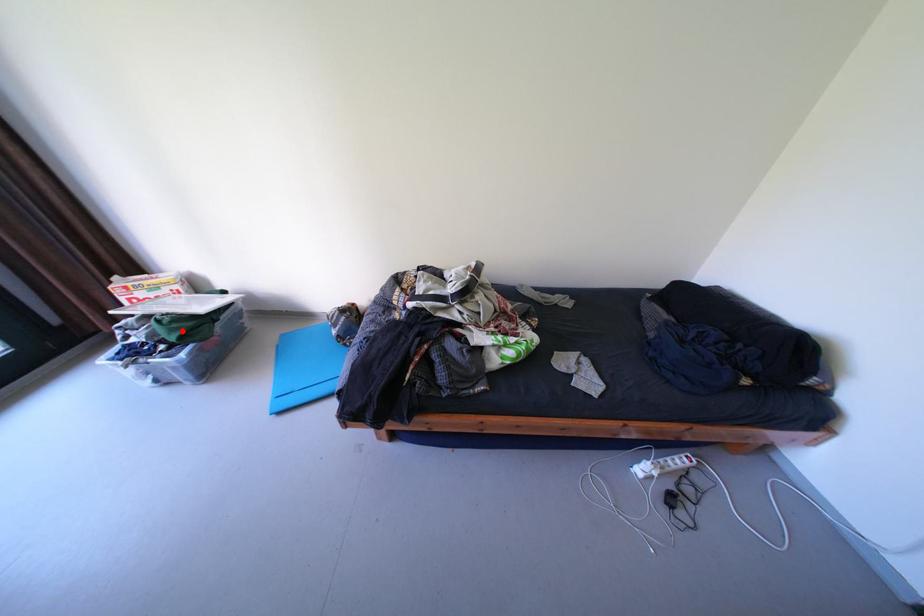
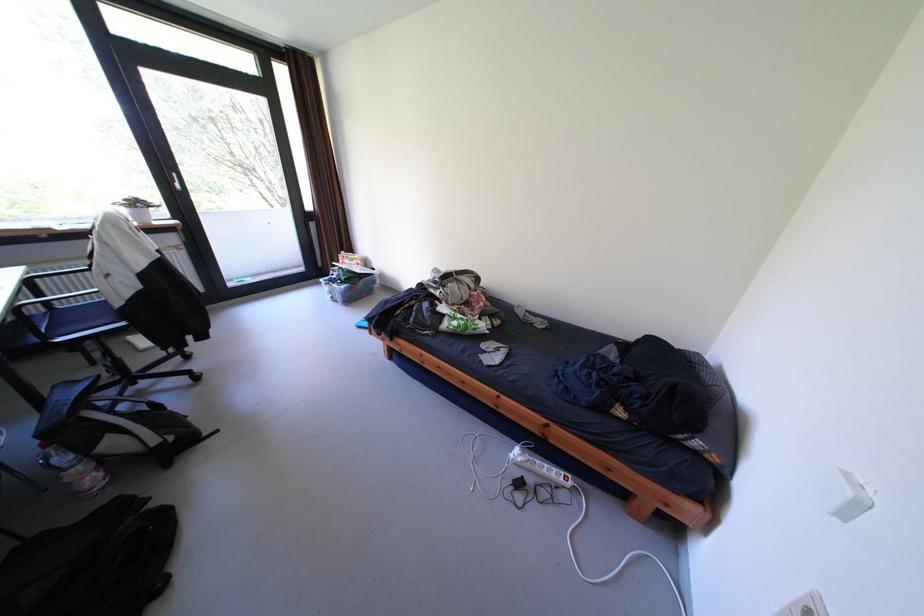
Question: I am providing you with two images of the same scene from different viewpoints. A red point is shown in image1. For the corresponding object point in image2, is it positioned nearer or farther from the camera?

Choices:
 (A) Nearer
 (B) Farther

Answer: (A)